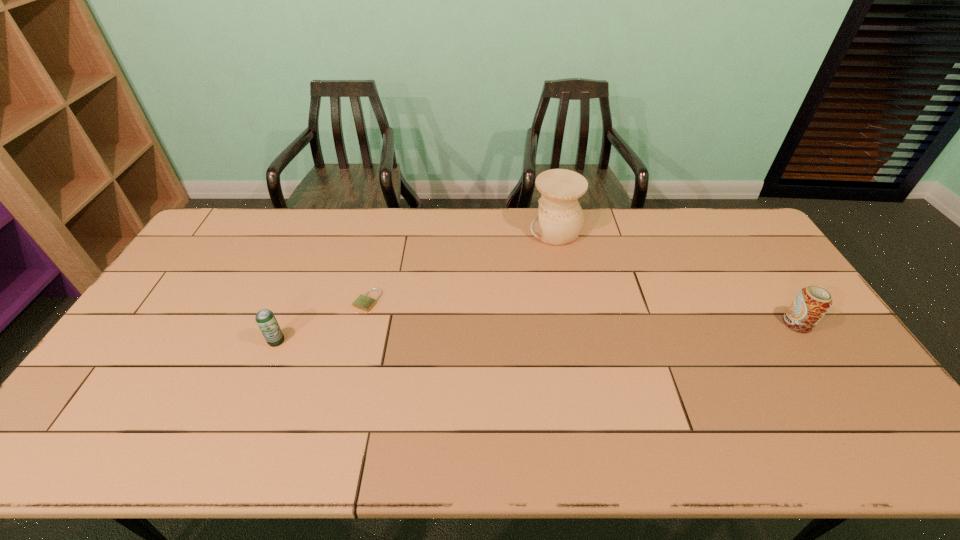
Locate an element on the screen. This screenshot has height=540, width=960. vacant space located at the open side of the pottery is located at coordinates (480, 231).

Find the location of a particular element. The image size is (960, 540). free space located on the front of the farther beer can is located at coordinates (883, 451).

Find the location of a particular element. The width and height of the screenshot is (960, 540). free space located on the right of the left beer can is located at coordinates (378, 341).

This screenshot has height=540, width=960. Find the location of `vacant space located on the left of the padlock`. vacant space located on the left of the padlock is located at coordinates (236, 300).

Locate an element on the screen. object that is at the far edge is located at coordinates (560, 219).

This screenshot has width=960, height=540. I want to click on object at the right edge, so click(x=811, y=303).

Find the location of a particular element. The image size is (960, 540). blank space at the far edge of the desktop is located at coordinates (659, 209).

Find the location of a particular element. vacant space at the near edge of the desktop is located at coordinates (620, 443).

This screenshot has height=540, width=960. Identify the location of vacant area at the right edge of the desktop. (743, 279).

Image resolution: width=960 pixels, height=540 pixels. I want to click on free space at the far left corner, so click(226, 228).